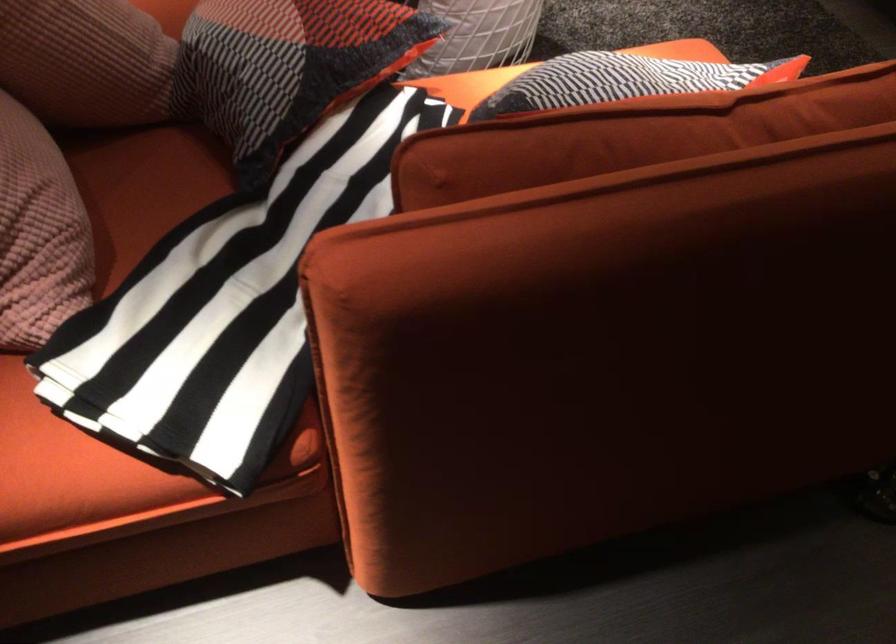
The image size is (896, 644). In order to click on sofa armrest in this screenshot , I will do `click(605, 353)`.